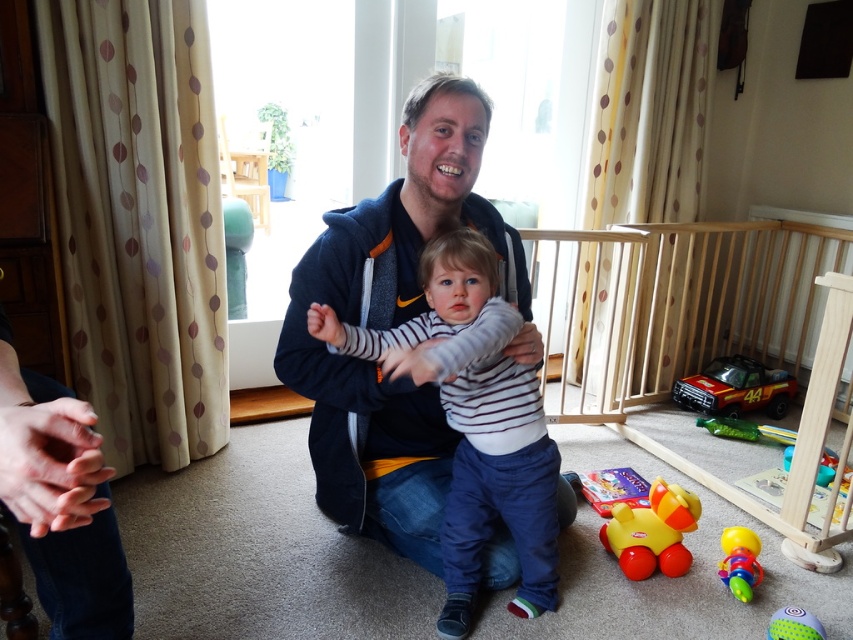
Based on the photo, you are a photographer setting up a shoot in this room. You need to position a light source so that it illuminates the striped cotton shirt at center without casting a shadow over the rubberized plastic rattle at lower right. Given their spatial relationship, is this possible?

The striped cotton shirt at center is in front of the rubberized plastic rattle at lower right. Therefore, placing the light source behind the shirt would cast a shadow directly onto the rattle, which is behind it. To avoid this, the light should be positioned to the side or above, ensuring light reaches both without obstruction.

In the scene shown: You are a parent who wants to give your child a toy that fits in their small hands. You have the rubber duck at lower center and the rubberized plastic rattle at lower right. Which toy should you choose?

The rubberized plastic rattle at lower right is smaller than the rubber duck at lower center, so it is better suited for the child to hold in their small hands.